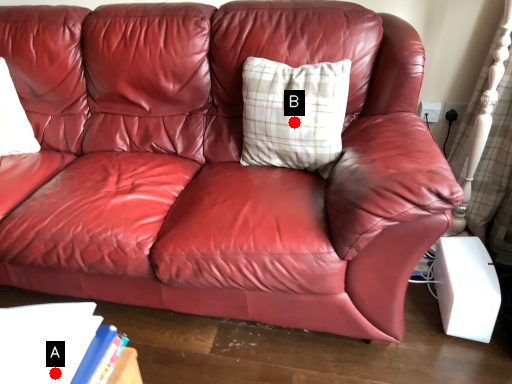
Question: Two points are circled on the image, labeled by A and B beside each circle. Which of the following is the closest to the observer?

Choices:
 (A) A is closer
 (B) B is closer

Answer: (A)